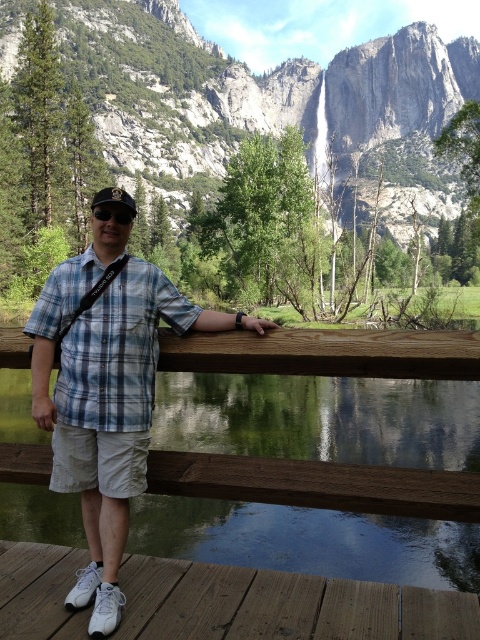
Question: Which object is closer to the camera taking this photo?

Choices:
 (A) green reflective water at center
 (B) black matte goggles at center
 (C) brown wooden deck at lower center
 (D) plaid cotton shirt at center

Answer: (C)

Question: Which of the following is the farthest from the observer?

Choices:
 (A) blue plaid shirt at center
 (B) brown wooden deck at lower center
 (C) plaid cotton shirt at center
 (D) black matte goggles at center

Answer: (D)

Question: Which object is farther from the camera taking this photo?

Choices:
 (A) granite cliff face at upper center
 (B) black matte goggles at center
 (C) plaid cotton shirt at center

Answer: (A)

Question: Does brown wooden deck at lower center appear on the left side of blue plaid shirt at center?

Choices:
 (A) yes
 (B) no

Answer: (B)

Question: Can you confirm if green reflective water at center is smaller than black matte goggles at center?

Choices:
 (A) yes
 (B) no

Answer: (B)

Question: Is granite cliff face at upper center to the left of brown wooden deck at lower center from the viewer's perspective?

Choices:
 (A) no
 (B) yes

Answer: (A)